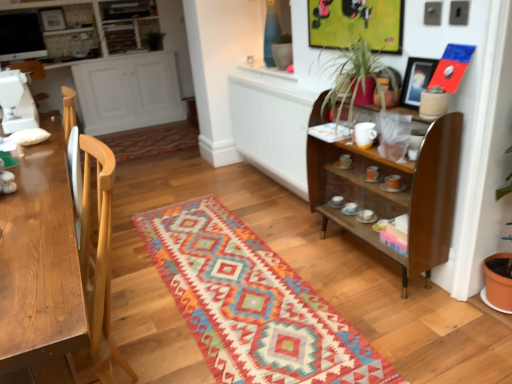
You are a GUI agent. You are given a task and a screenshot of the screen. Output one action in this format:
    pyautogui.click(x=<x>, y=<y>)
    Task: Click on the vacant space in front of glossy wood shelf at upper right
    
    Given the screenshot: What is the action you would take?
    pyautogui.click(x=407, y=314)